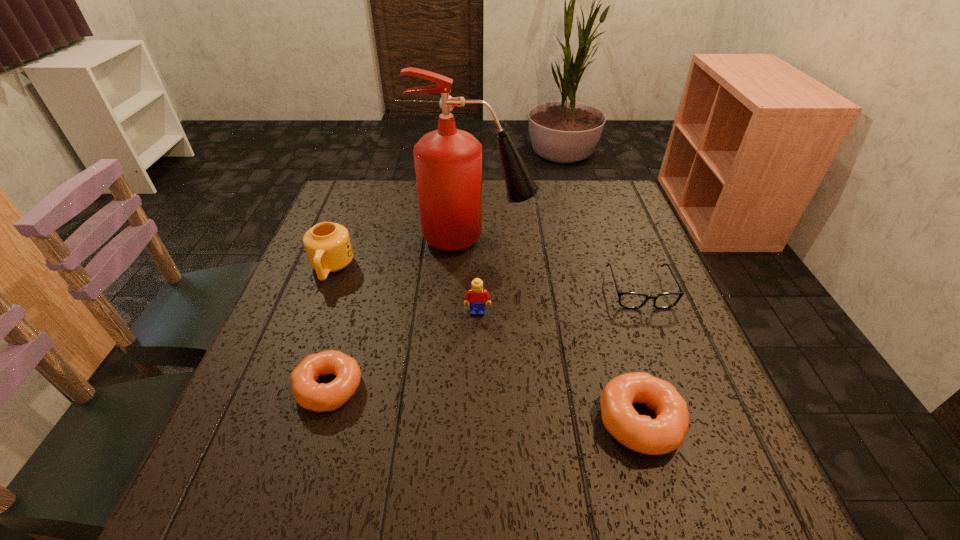
Where is `vacant region that satisfies the following two spatial constraints: 1. on the handle side of the mug; 2. on the right side of the taller doughnut`? This screenshot has width=960, height=540. vacant region that satisfies the following two spatial constraints: 1. on the handle side of the mug; 2. on the right side of the taller doughnut is located at coordinates (274, 421).

Locate an element on the screen. vacant space that satisfies the following two spatial constraints: 1. with the nozzle aimed from the tallest object; 2. on the handle side of the mug is located at coordinates (476, 268).

At what (x,y) coordinates should I click in order to perform the action: click on free location that satisfies the following two spatial constraints: 1. on the handle side of the third shortest object; 2. on the right side of the mug. Please return your answer as a coordinate pair (x, y). Image resolution: width=960 pixels, height=540 pixels. Looking at the image, I should click on (274, 421).